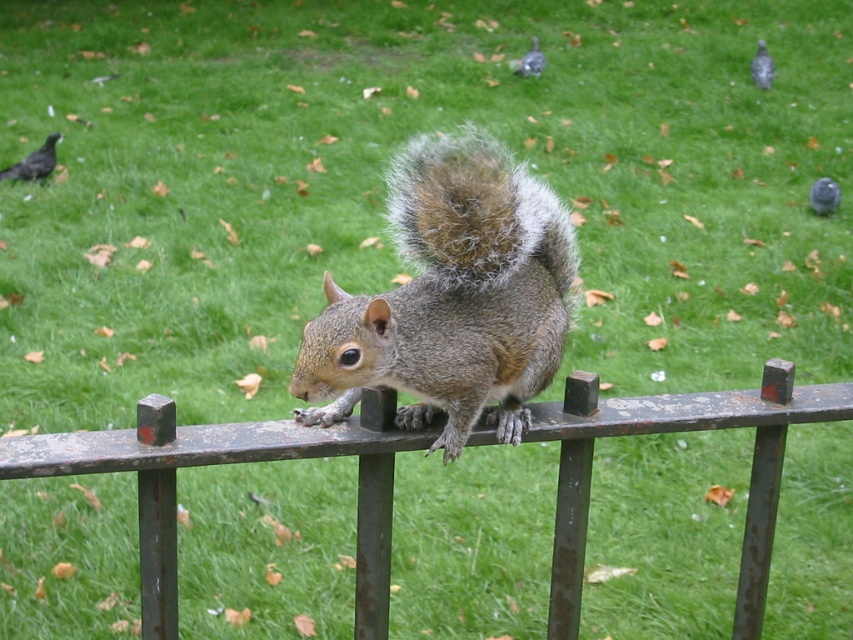
Question: Is rusty metal fence at center bigger than gray matte pigeon at upper right?

Choices:
 (A) no
 (B) yes

Answer: (B)

Question: Which object is the farthest from the shiny black bird at upper left?

Choices:
 (A) gray matte pigeon at upper right
 (B) gray furry squirrel at center
 (C) matte gray pigeon at upper right

Answer: (B)

Question: Does rusty metal fence at center appear on the right side of shiny black bird at upper left?

Choices:
 (A) yes
 (B) no

Answer: (A)

Question: Which of the following is the farthest from the observer?

Choices:
 (A) rusty metal fence at center
 (B) gray matte pigeon at upper right
 (C) matte gray pigeon at upper right
 (D) shiny black bird at upper left

Answer: (B)

Question: Which of the following is the farthest from the observer?

Choices:
 (A) [51, 163]
 (B) [310, 380]

Answer: (A)

Question: Does rusty metal fence at center have a smaller size compared to gray matte pigeon at upper right?

Choices:
 (A) yes
 (B) no

Answer: (B)